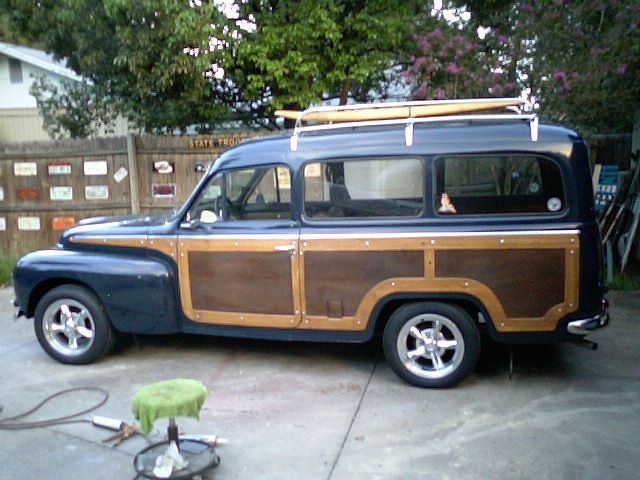
Where is `stool`? The image size is (640, 480). stool is located at coordinates (192, 451).